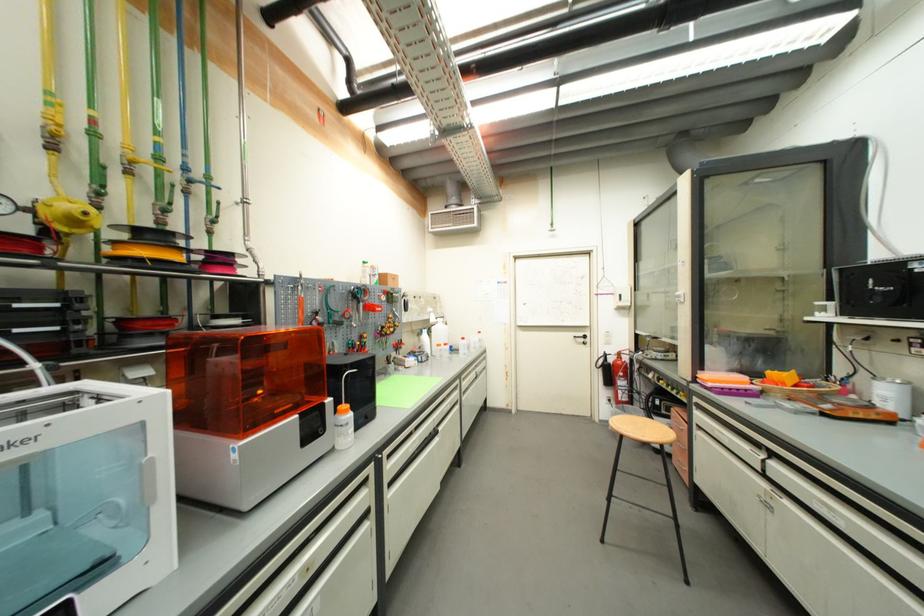
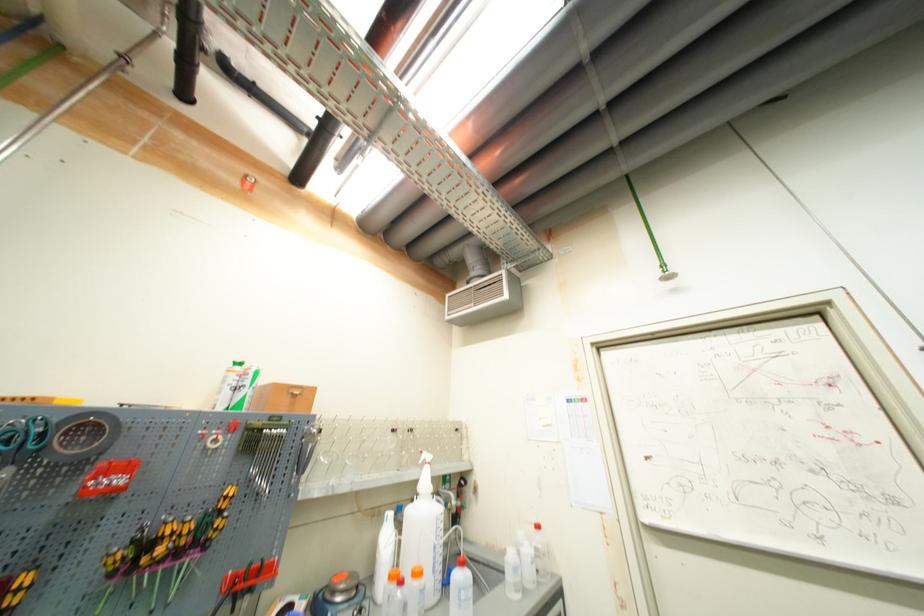
Find the pixel in the second image that matches (x=327, y=120) in the first image.

(253, 185)